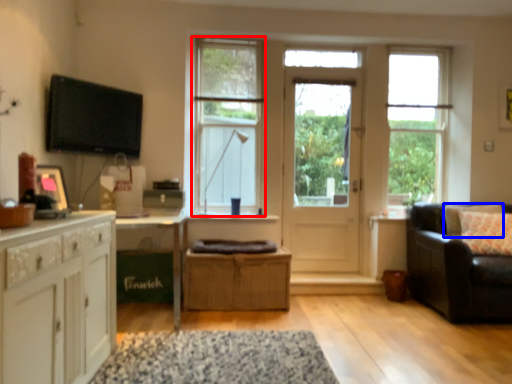
Question: Which object is further to the camera taking this photo, window (highlighted by a red box) or pillow (highlighted by a blue box)?

Choices:
 (A) window
 (B) pillow

Answer: (A)